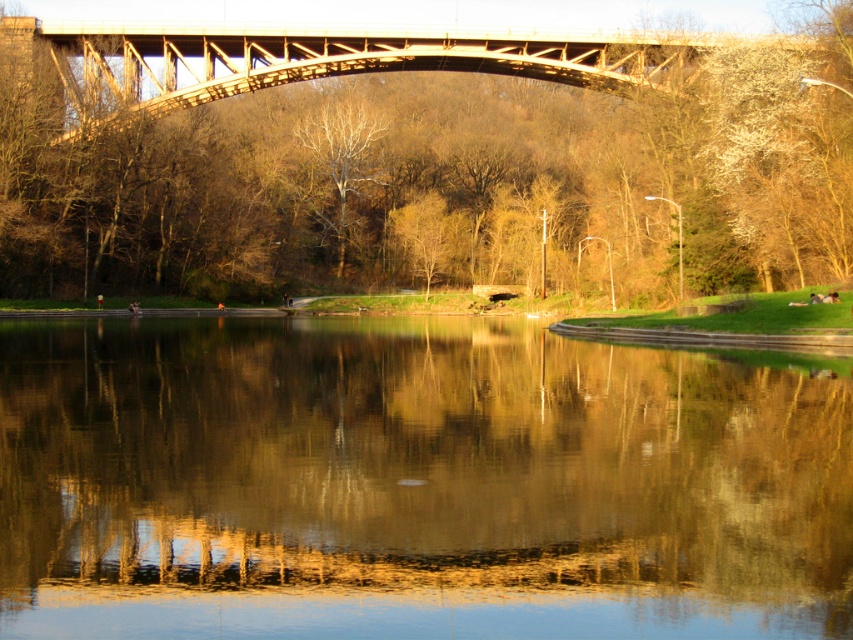
Is point (694, 504) farther from camera compared to point (683, 67)?

No, it is in front of (683, 67).

I want to click on smooth reflective water at center, so click(x=413, y=483).

Locate an element on the screen. smooth reflective water at center is located at coordinates (413, 483).

Is smooth brown tree at center wider than metallic bridge at upper center?

Yes, smooth brown tree at center is wider than metallic bridge at upper center.

Between smooth brown tree at center and metallic bridge at upper center, which one appears on the left side from the viewer's perspective?

From the viewer's perspective, metallic bridge at upper center appears more on the left side.

Where is `smooth brown tree at center`? This screenshot has height=640, width=853. smooth brown tree at center is located at coordinates (418, 157).

Does smooth reflective water at center have a larger size compared to smooth brown tree at center?

No.

Does smooth reflective water at center have a lesser height compared to smooth brown tree at center?

Indeed, smooth reflective water at center has a lesser height compared to smooth brown tree at center.

Is point (56, 577) positioned behind point (564, 211)?

No, (56, 577) is in front of (564, 211).

Locate an element on the screen. smooth reflective water at center is located at coordinates (413, 483).